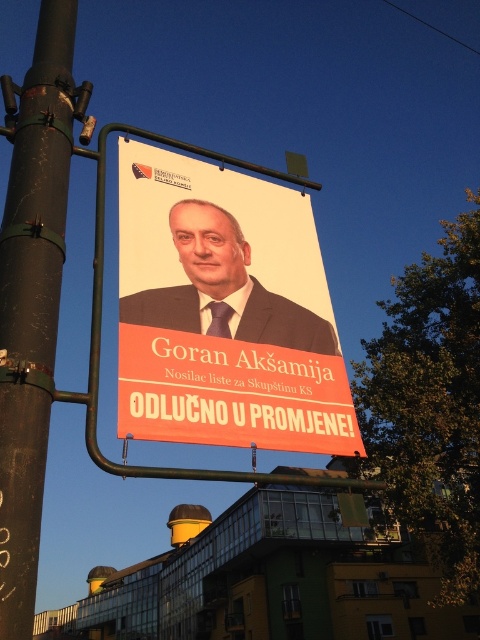
Question: Which is farther from the matte black suit at center?

Choices:
 (A) green painted metal pole at left
 (B) matte black poster at center

Answer: (A)

Question: Which point is farther from the camera taking this photo?

Choices:
 (A) (40, 440)
 (B) (243, 340)

Answer: (B)

Question: Is matte black poster at center bigger than matte black suit at center?

Choices:
 (A) no
 (B) yes

Answer: (B)

Question: Can you confirm if matte black poster at center is bigger than green painted metal pole at left?

Choices:
 (A) no
 (B) yes

Answer: (A)

Question: Does matte black poster at center appear on the left side of matte black suit at center?

Choices:
 (A) yes
 (B) no

Answer: (B)

Question: Which of these objects is positioned farthest from the matte black poster at center?

Choices:
 (A) green painted metal pole at left
 (B) matte black suit at center

Answer: (A)